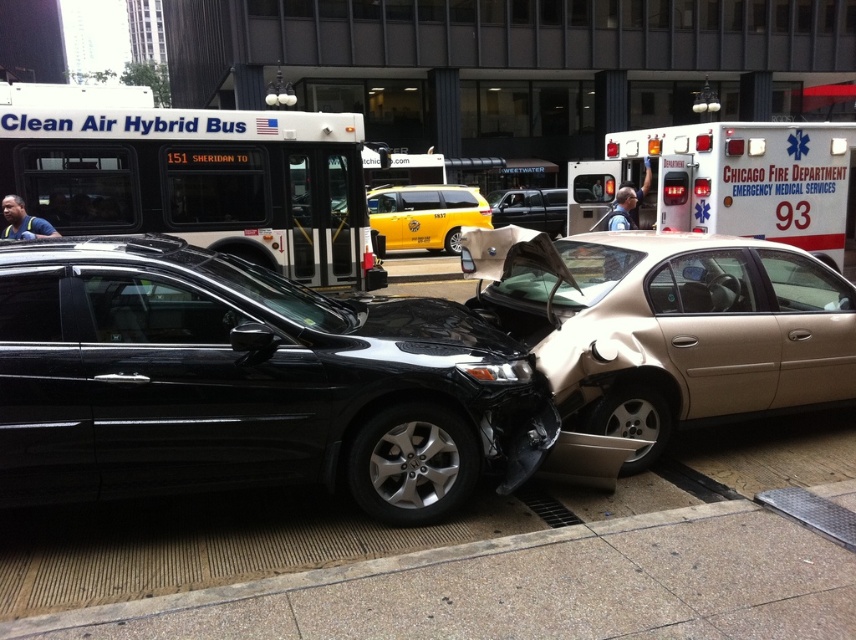
Question: Is gold metallic sedan at center thinner than yellow matte taxi at center?

Choices:
 (A) yes
 (B) no

Answer: (A)

Question: Which object appears farthest from the camera in this image?

Choices:
 (A) yellow matte taxi at center
 (B) glossy black sedan at center

Answer: (A)

Question: Is glossy black sedan at center positioned at the back of white/smooth ambulance at right?

Choices:
 (A) no
 (B) yes

Answer: (A)

Question: Does glossy black sedan at center lie in front of white/smooth ambulance at right?

Choices:
 (A) no
 (B) yes

Answer: (B)

Question: Which of these objects is positioned farthest from the glossy black sedan at center?

Choices:
 (A) gold metallic sedan at center
 (B) yellow matte taxi at center

Answer: (B)

Question: Estimate the real-world distances between objects in this image. Which object is farther from the gold metallic sedan at center?

Choices:
 (A) glossy black sedan at center
 (B) white/smooth ambulance at right
 (C) yellow matte taxi at center

Answer: (C)